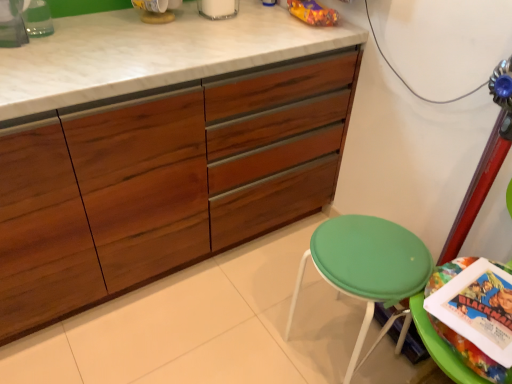
Locate an element on the screen. This screenshot has width=512, height=384. vacant space to the left of green fabric stool at lower right is located at coordinates (252, 328).